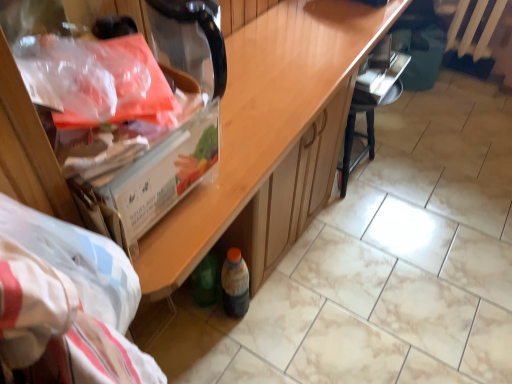
Question: From the image's perspective, relative to black wood chair at center, is translucent plastic bag at upper left above or below?

Choices:
 (A) above
 (B) below

Answer: (B)

Question: In the image, is translucent plastic bag at upper left on the left side or the right side of black wood chair at center?

Choices:
 (A) left
 (B) right

Answer: (A)

Question: Which is nearer to the translucent plastic bag at upper left?

Choices:
 (A) black wood chair at center
 (B) metallic silver radiator at upper right
 (C) translucent plastic bottle at lower center

Answer: (C)

Question: Estimate the real-world distances between objects in this image. Which object is closer to the translucent plastic bag at upper left?

Choices:
 (A) black wood chair at center
 (B) metallic silver radiator at upper right
 (C) translucent plastic bottle at lower center

Answer: (C)